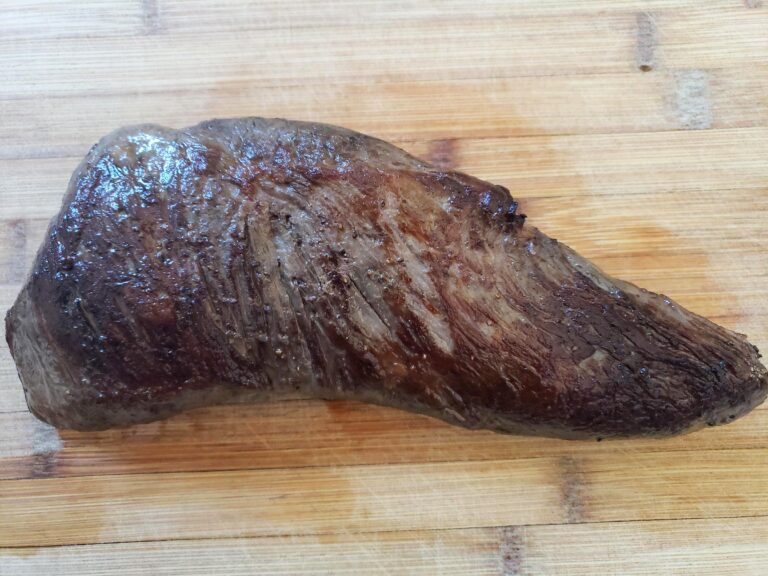
Locate an element on the screen. wooden cutting board is located at coordinates (545, 126).